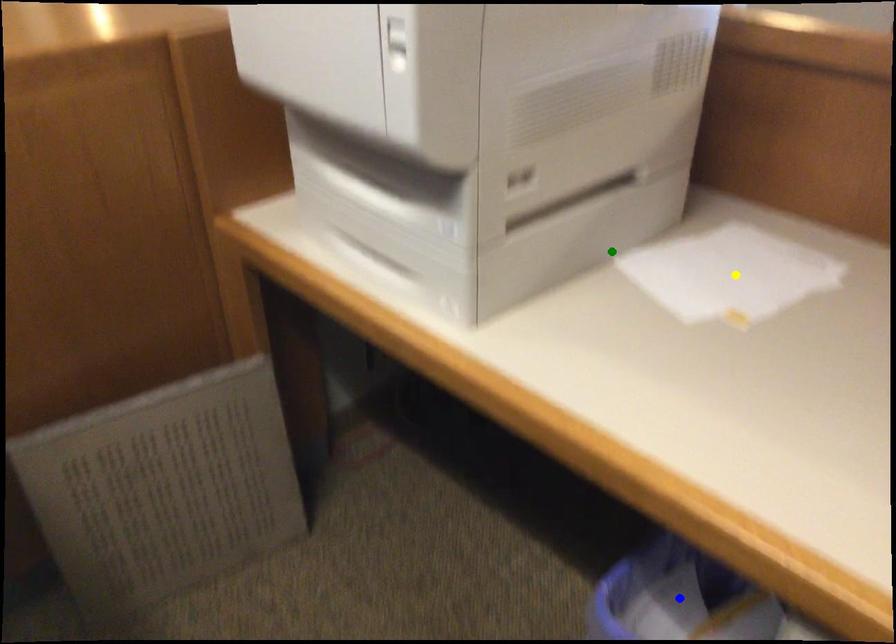
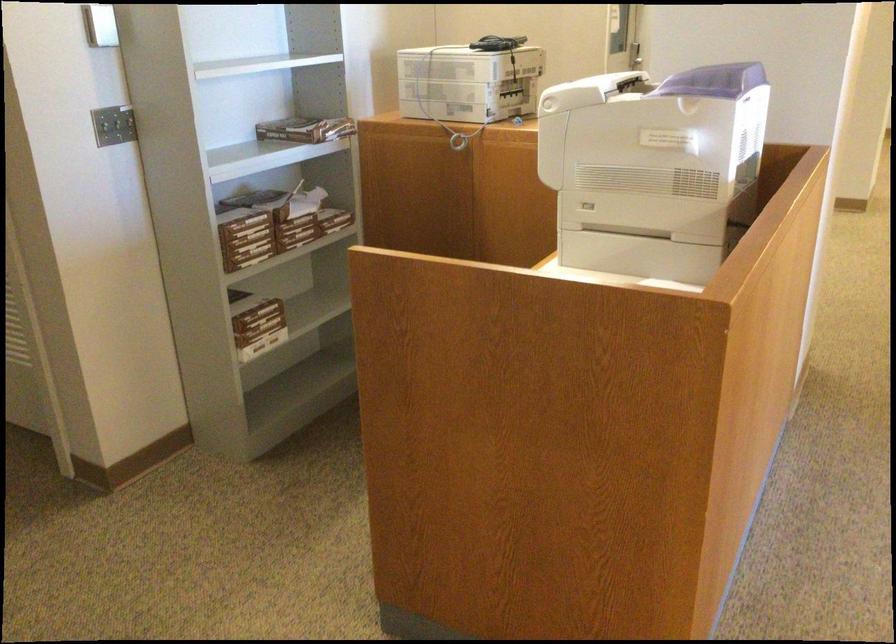
I am providing you with two images of the same scene from different viewpoints. Three points are marked in image1. Which point corresponds to a part or object that is occluded in image2?In image1, three points are marked. Which of them correspond to a part or object that is occluded in image2?Among the three points shown in image1, which one corresponds to a part or object that is no longer visible due to occlusion in image2?

yellow point, blue point cannot be seen in image2.